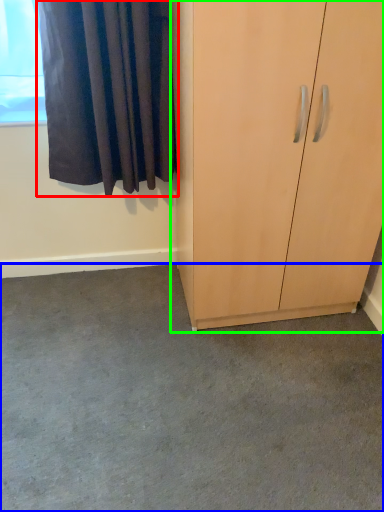
Question: Which object is positioned closest to curtain (highlighted by a red box)? Select from concrete (highlighted by a blue box) and cupboard (highlighted by a green box).

Choices:
 (A) concrete
 (B) cupboard

Answer: (B)